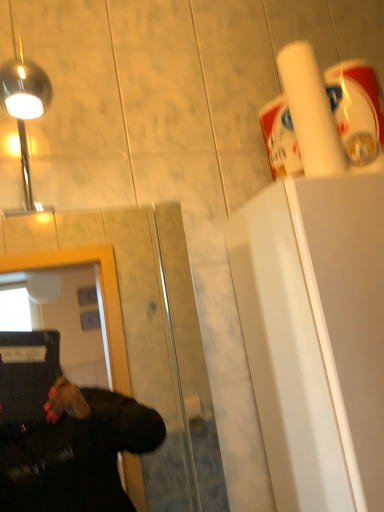
In order to face white matte paper towel at upper right, should I rotate leftwards or rightwards?

A 15.398 degree turn to the right will do.

At what (x,y) coordinates should I click in order to perform the action: click on transparent glass door at center. Please return your answer as a coordinate pair (x, y). The image size is (384, 512). Looking at the image, I should click on (127, 334).

The height and width of the screenshot is (512, 384). In order to click on polished chrome light at upper left in this screenshot , I will do tap(24, 104).

At what (x,y) coordinates should I click in order to perform the action: click on white matte paper towel at upper right. Please return your answer as a coordinate pair (x, y). This screenshot has height=512, width=384. Looking at the image, I should click on (310, 111).

Locate an element on the screen. Image resolution: width=384 pixels, height=512 pixels. glass door on the left of white matte paper towel at upper right is located at coordinates (127, 334).

Consider the image. Which object is further away from the camera taking this photo, white matte paper towel at upper right or transparent glass door at center?

white matte paper towel at upper right is further away from the camera.

Which is correct: white matte paper towel at upper right is inside transparent glass door at center, or outside of it?

white matte paper towel at upper right cannot be found inside transparent glass door at center.

From the image's perspective, between white matte paper towel at upper right and transparent glass door at center, which one is located above?

From the image's view, white matte paper towel at upper right is above.

Is transparent glass door at center to the left of polished chrome light at upper left from the viewer's perspective?

No, transparent glass door at center is not to the left of polished chrome light at upper left.

In the scene shown: Does transparent glass door at center have a greater width compared to polished chrome light at upper left?

Incorrect, the width of transparent glass door at center does not surpass that of polished chrome light at upper left.

From the image's perspective, which is above, transparent glass door at center or polished chrome light at upper left?

polished chrome light at upper left appears higher in the image.

Can you confirm if transparent glass door at center is bigger than polished chrome light at upper left?

Indeed, transparent glass door at center has a larger size compared to polished chrome light at upper left.

Considering the points (35, 75) and (291, 66), which point is behind, point (35, 75) or point (291, 66)?

The point (291, 66) is behind.

From the image's perspective, which is above, polished chrome light at upper left or white matte paper towel at upper right?

white matte paper towel at upper right, from the image's perspective.

Is polished chrome light at upper left taller or shorter than white matte paper towel at upper right?

Clearly, polished chrome light at upper left is shorter compared to white matte paper towel at upper right.

Considering the relative positions of polished chrome light at upper left and white matte paper towel at upper right in the image provided, is polished chrome light at upper left to the right of white matte paper towel at upper right from the viewer's perspective?

In fact, polished chrome light at upper left is to the left of white matte paper towel at upper right.

Does transparent glass door at center have a smaller size compared to white matte paper towel at upper right?

Actually, transparent glass door at center might be larger than white matte paper towel at upper right.

Considering the sizes of transparent glass door at center and white matte paper towel at upper right in the image, is transparent glass door at center wider or thinner than white matte paper towel at upper right?

Considering their sizes, transparent glass door at center looks broader than white matte paper towel at upper right.

Can you tell me how much transparent glass door at center and white matte paper towel at upper right differ in facing direction?

There is a 1.62-degree angle between the facing directions of transparent glass door at center and white matte paper towel at upper right.

Is transparent glass door at center surrounding white matte paper towel at upper right?

Actually, white matte paper towel at upper right is outside transparent glass door at center.

Considering the sizes of polished chrome light at upper left and transparent glass door at center in the image, is polished chrome light at upper left taller or shorter than transparent glass door at center?

polished chrome light at upper left is shorter than transparent glass door at center.

Locate an element on the screen. Image resolution: width=384 pixels, height=512 pixels. light fixture that is on the left side of transparent glass door at center is located at coordinates (24, 104).

Is polished chrome light at upper left closer to the viewer compared to transparent glass door at center?

No, it is behind transparent glass door at center.

Is there a large distance between white matte paper towel at upper right and polished chrome light at upper left?

That's not correct — white matte paper towel at upper right is a little close to polished chrome light at upper left.

From the picture: From a real-world perspective, between white matte paper towel at upper right and polished chrome light at upper left, who is vertically higher?

white matte paper towel at upper right is physically above.

Is white matte paper towel at upper right to the left of polished chrome light at upper left from the viewer's perspective?

In fact, white matte paper towel at upper right is to the right of polished chrome light at upper left.

Is white matte paper towel at upper right not within polished chrome light at upper left?

Yes, white matte paper towel at upper right is outside of polished chrome light at upper left.

At what (x,y) coordinates should I click in order to perform the action: click on glass door located below the white matte paper towel at upper right (from the image's perspective). Please return your answer as a coordinate pair (x, y). The height and width of the screenshot is (512, 384). Looking at the image, I should click on (127, 334).

At what (x,y) coordinates should I click in order to perform the action: click on glass door lying in front of the polished chrome light at upper left. Please return your answer as a coordinate pair (x, y). Looking at the image, I should click on (127, 334).

Based on their spatial positions, is white matte paper towel at upper right or polished chrome light at upper left closer to transparent glass door at center?

Based on the image, white matte paper towel at upper right appears to be nearer to transparent glass door at center.

From the image, which object appears to be farther from polished chrome light at upper left, transparent glass door at center or white matte paper towel at upper right?

Based on the image, transparent glass door at center appears to be further to polished chrome light at upper left.

Considering their positions, is polished chrome light at upper left positioned further to transparent glass door at center than white matte paper towel at upper right?

Based on the image, polished chrome light at upper left appears to be further to transparent glass door at center.

Considering their positions, is polished chrome light at upper left positioned further to white matte paper towel at upper right than transparent glass door at center?

transparent glass door at center lies further to white matte paper towel at upper right than the other object.

Looking at the image, which one is located closer to polished chrome light at upper left, white matte paper towel at upper right or transparent glass door at center?

Among the two, white matte paper towel at upper right is located nearer to polished chrome light at upper left.

Looking at the image, which one is located closer to white matte paper towel at upper right, transparent glass door at center or polished chrome light at upper left?

Based on the image, polished chrome light at upper left appears to be nearer to white matte paper towel at upper right.

This screenshot has width=384, height=512. Identify the location of light fixture that lies between white matte paper towel at upper right and transparent glass door at center from top to bottom. (24, 104).